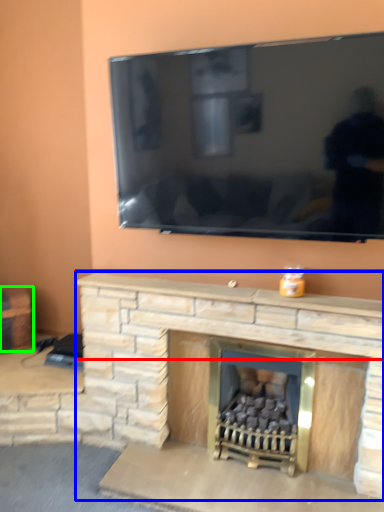
Question: Which object is the farthest from mantle (highlighted by a red box)? Choose among these: fireplace (highlighted by a blue box) or furniture (highlighted by a green box).

Choices:
 (A) fireplace
 (B) furniture

Answer: (B)